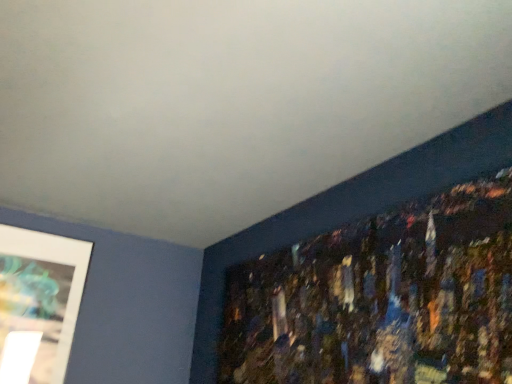
The image size is (512, 384). What do you see at coordinates (38, 303) in the screenshot?
I see `white matte picture frame at left` at bounding box center [38, 303].

Locate an element on the screen. This screenshot has width=512, height=384. white matte picture frame at left is located at coordinates (38, 303).

In order to face white matte picture frame at left, should I rotate leftwards or rightwards?

You should rotate left by 27.719 degrees.

Find the location of a particular element. The image size is (512, 384). white matte picture frame at left is located at coordinates (38, 303).